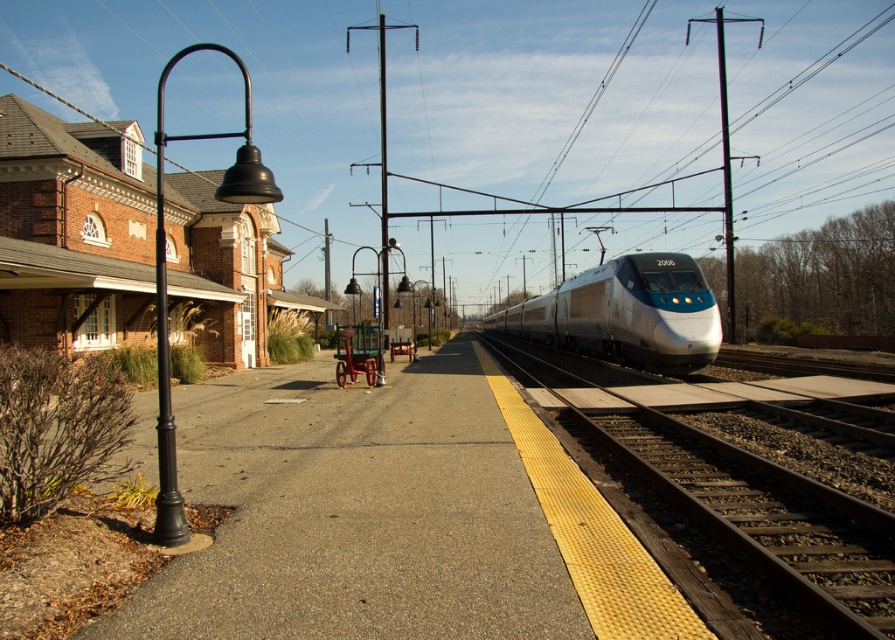
Question: Which object is positioned farthest from the metallic pole at center?

Choices:
 (A) metallic pole at right
 (B) silver metallic train at center

Answer: (A)

Question: Can you confirm if silver metallic train at center is positioned to the left of metallic pole at right?

Choices:
 (A) no
 (B) yes

Answer: (B)

Question: Does metallic gray train track at center appear on the left side of metallic pole at center?

Choices:
 (A) no
 (B) yes

Answer: (A)

Question: Among these points, which one is farthest from the camera?

Choices:
 (A) (386, 198)
 (B) (672, 269)
 (C) (719, 458)
 (D) (723, 106)

Answer: (D)

Question: Among these objects, which one is farthest from the camera?

Choices:
 (A) metallic gray train track at center
 (B) metallic pole at center
 (C) silver metallic train at center

Answer: (B)

Question: Does metallic gray train track at center appear on the left side of metallic pole at right?

Choices:
 (A) yes
 (B) no

Answer: (A)